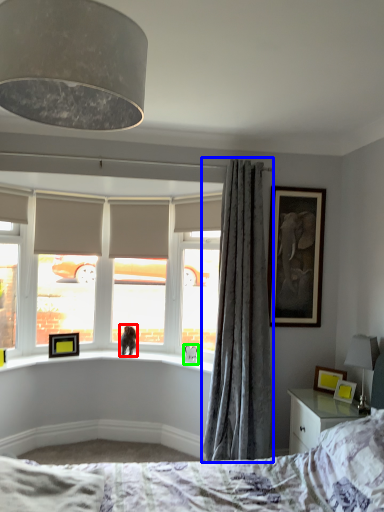
Question: Which object is positioned closest to animal (highlighted by a red box)? Select from curtain (highlighted by a blue box) and animal (highlighted by a green box).

Choices:
 (A) curtain
 (B) animal

Answer: (B)